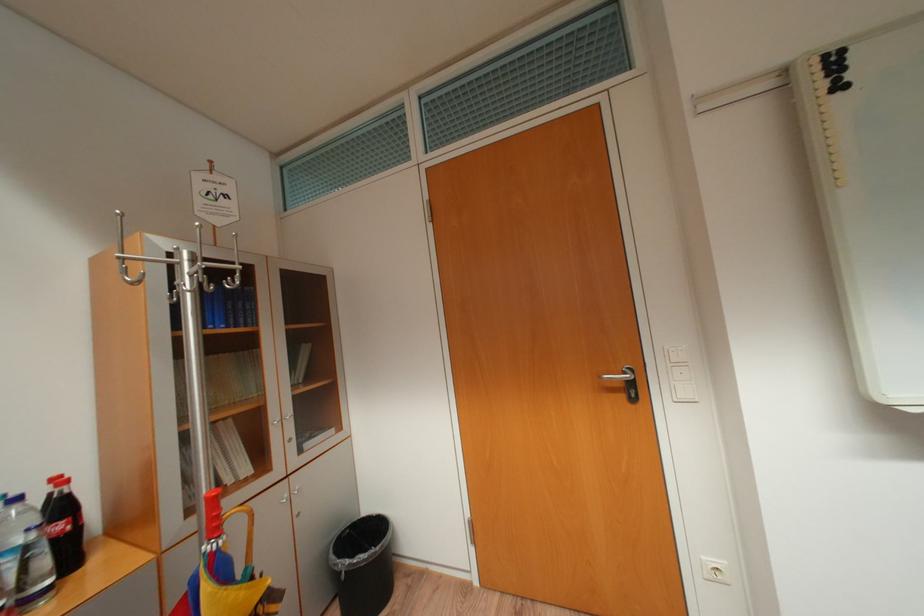
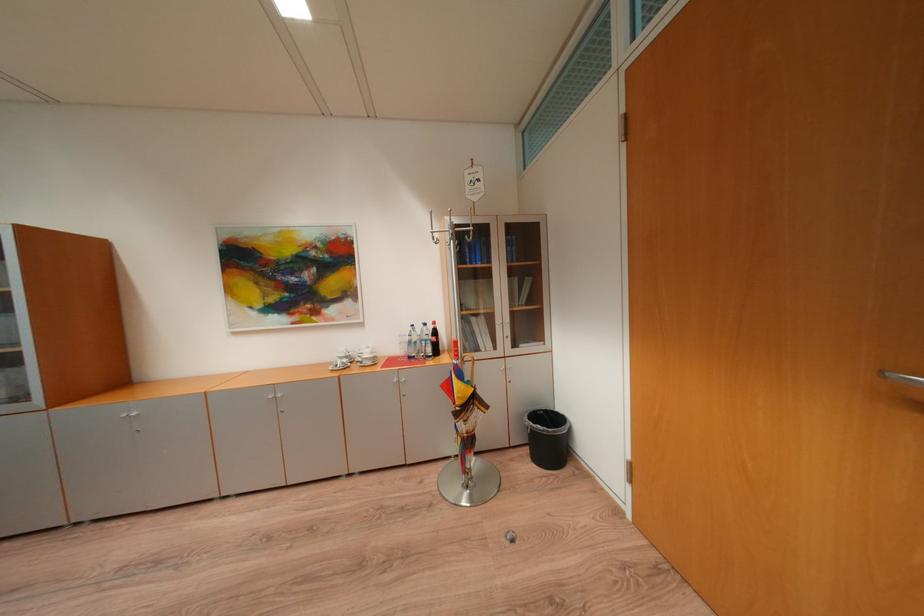
Question: The first image is from the beginning of the video and the second image is from the end. How did the camera likely rotate when shooting the video?

Choices:
 (A) Left
 (B) Right
 (C) Up
 (D) Down

Answer: (A)